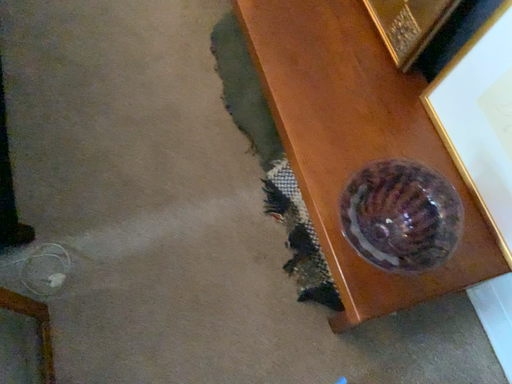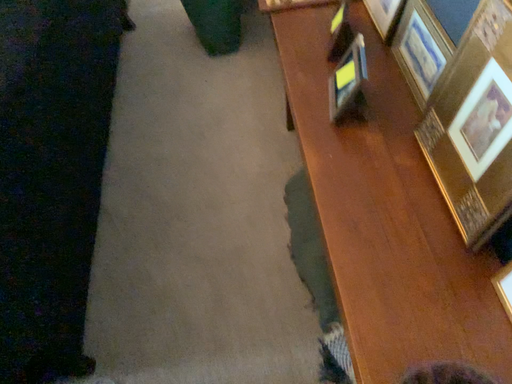
Question: How did the camera likely rotate when shooting the video?

Choices:
 (A) rotated downward
 (B) rotated upward

Answer: (B)